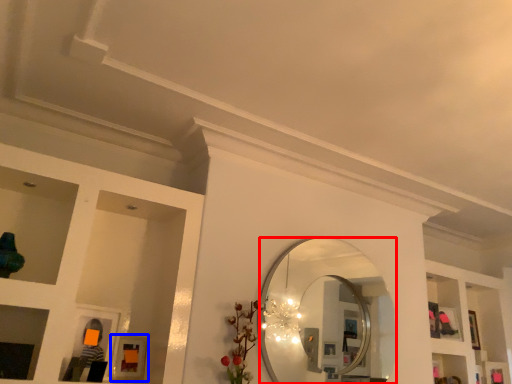
Question: Which of the following is the closest to the observer, mirror (highlighted by a red box) or picture frame (highlighted by a blue box)?

Choices:
 (A) mirror
 (B) picture frame

Answer: (B)